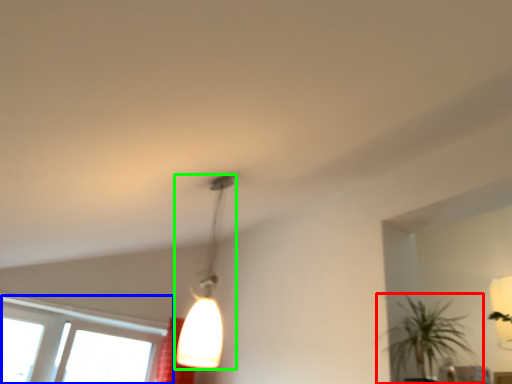
Question: Which object is the farthest from houseplant (highlighted by a red box)? Choose among these: window (highlighted by a blue box) or lamp (highlighted by a green box).

Choices:
 (A) window
 (B) lamp

Answer: (A)